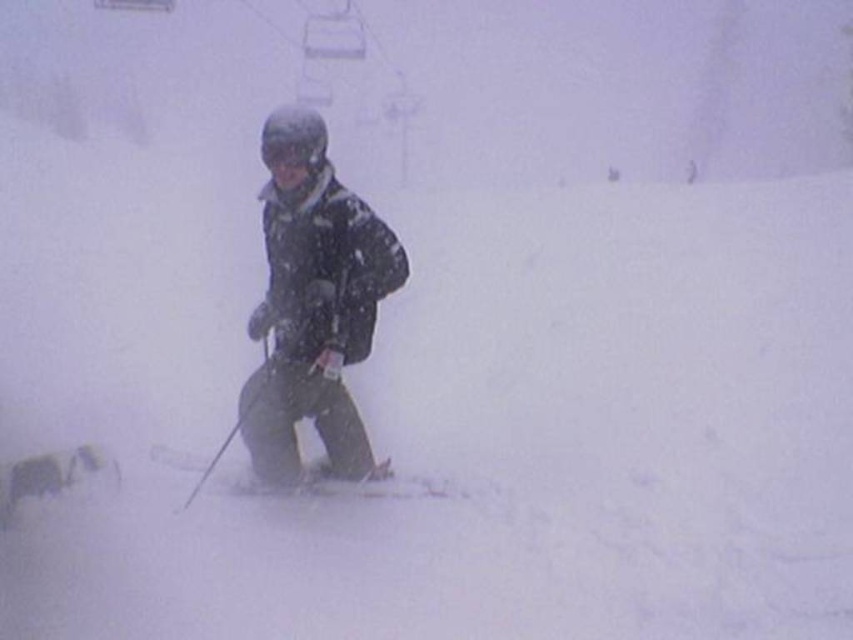
Question: Which point appears closest to the camera in this image?

Choices:
 (A) click(221, 477)
 (B) click(316, 156)

Answer: (B)

Question: Observing the image, what is the correct spatial positioning of matte black ski at center in reference to matte black goggles at center?

Choices:
 (A) right
 (B) left

Answer: (B)

Question: Is matte black ski at center in front of matte black goggles at center?

Choices:
 (A) yes
 (B) no

Answer: (B)

Question: Among these objects, which one is farthest from the camera?

Choices:
 (A) matte black goggles at center
 (B) matte black ski at center

Answer: (B)

Question: Is matte black ski at center below matte black goggles at center?

Choices:
 (A) no
 (B) yes

Answer: (B)